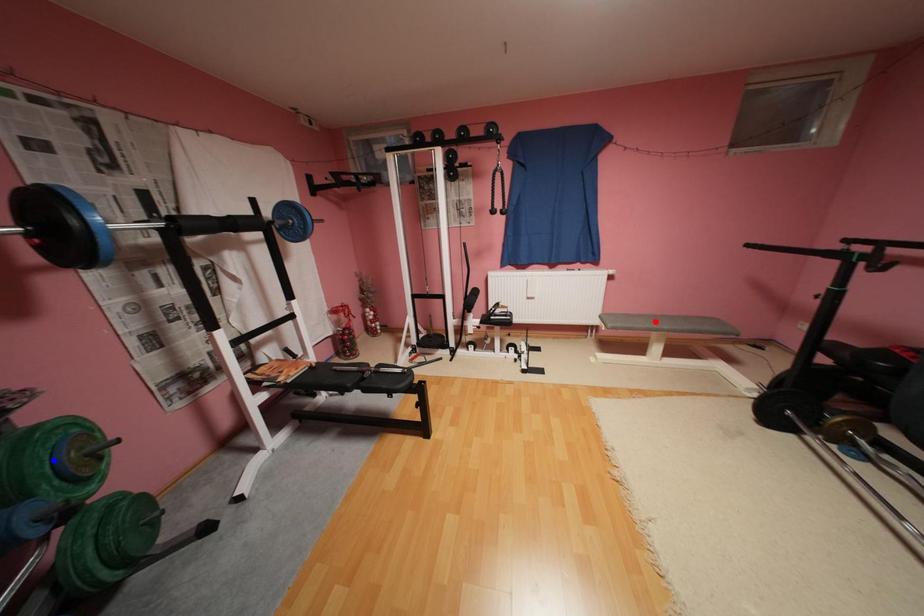
Question: Two points are marked on the image. Which point is closer to the camera?

Choices:
 (A) Blue point is closer.
 (B) Red point is closer.

Answer: (A)